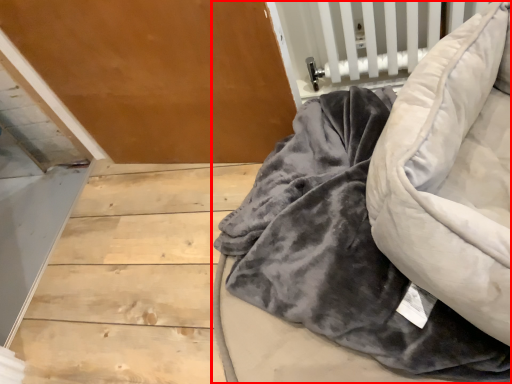
Question: In this image, where is furniture (annotated by the red box) located relative to bean bag chair?

Choices:
 (A) left
 (B) right

Answer: (A)